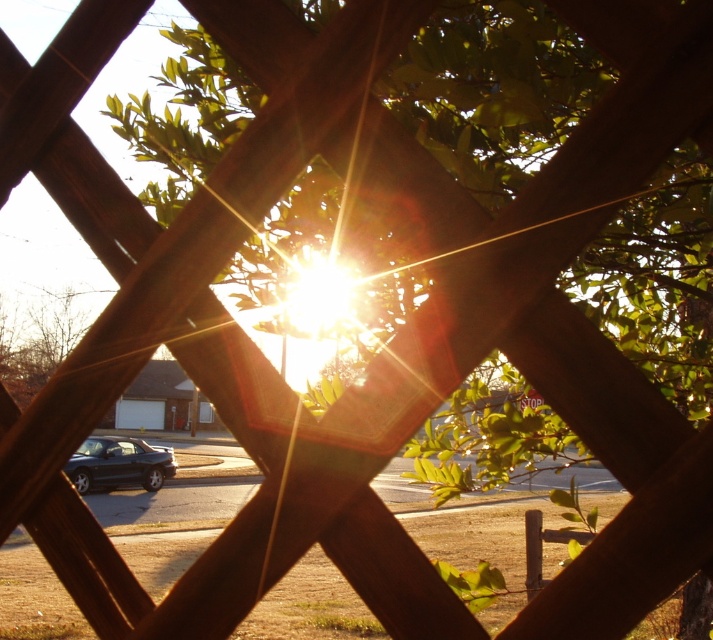
Question: Which point is closer to the camera?

Choices:
 (A) metallic silver stop sign at center
 (B) shiny black car at center

Answer: (B)

Question: Is shiny black car at center to the right of metallic silver stop sign at center from the viewer's perspective?

Choices:
 (A) yes
 (B) no

Answer: (B)

Question: Which point appears farthest from the camera in this image?

Choices:
 (A) (106, 440)
 (B) (525, 401)

Answer: (A)

Question: Does shiny black car at center appear over metallic silver stop sign at center?

Choices:
 (A) yes
 (B) no

Answer: (B)

Question: Can you confirm if shiny black car at center is wider than metallic silver stop sign at center?

Choices:
 (A) yes
 (B) no

Answer: (A)